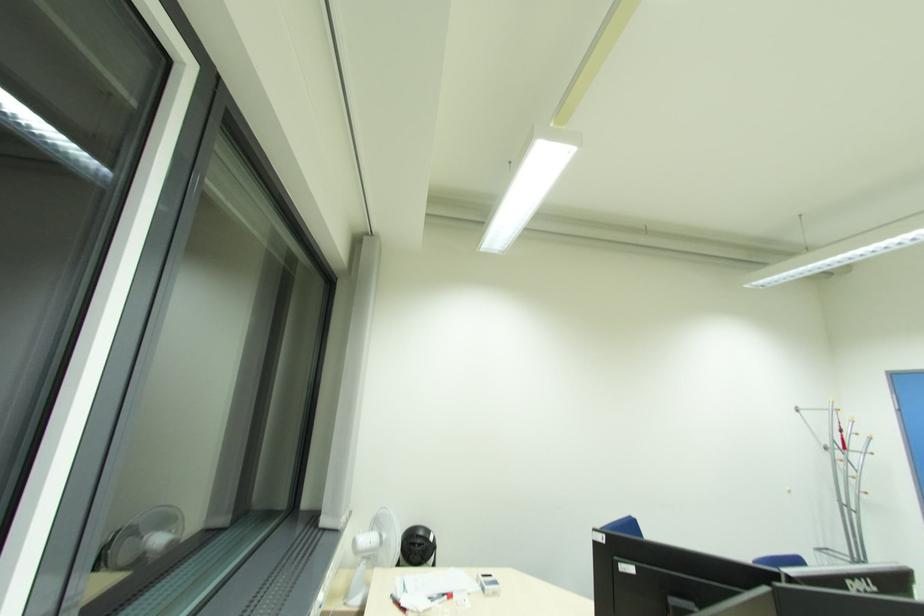
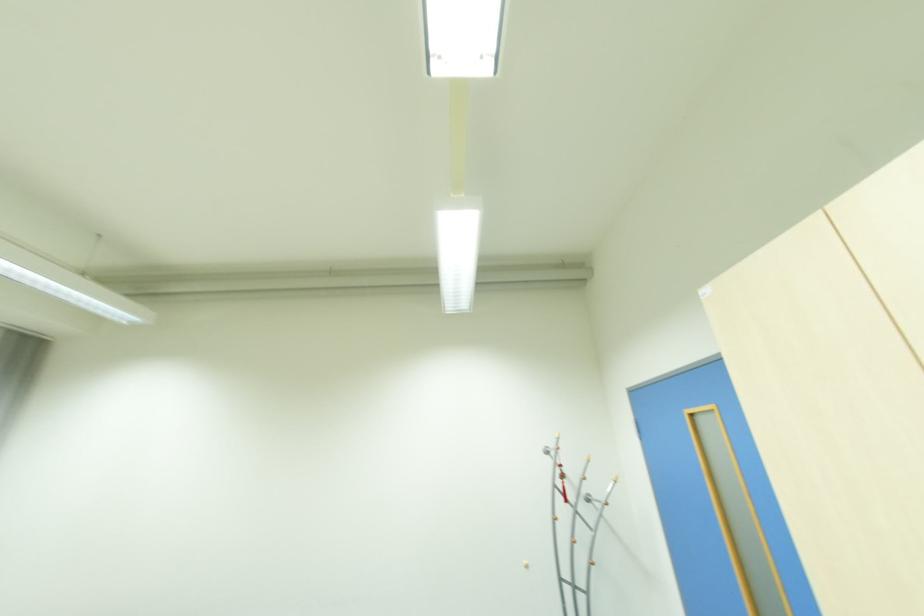
Question: The images are taken continuously from a first-person perspective. In which direction are you moving?

Choices:
 (A) Left
 (B) Right
 (C) Forward
 (D) Backward

Answer: (B)